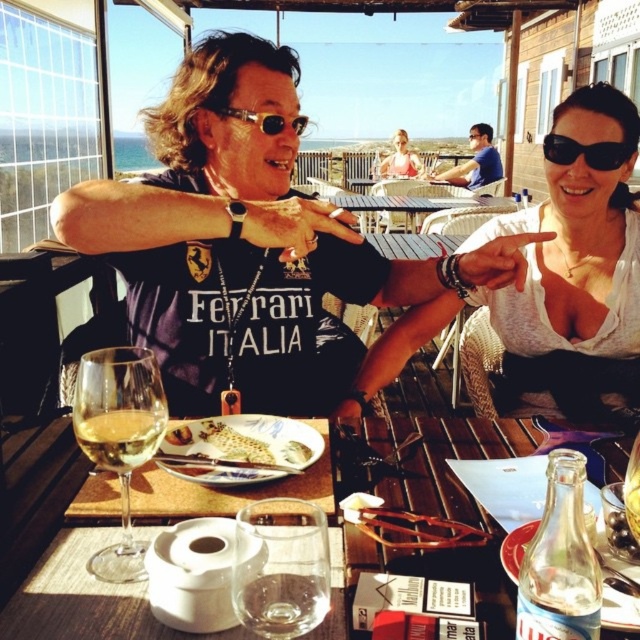
Question: Estimate the real-world distances between objects in this image. Which object is closer to the golden crispy bread at center?

Choices:
 (A) white creamy pasta at center
 (B) clear glass table at center

Answer: (A)

Question: Estimate the real-world distances between objects in this image. Which object is closer to the golden crispy pastry at center?

Choices:
 (A) translucent glass wine at lower left
 (B) white translucent glass at lower left
 (C) clear glass table at center
 (D) black plastic sunglasses at upper right

Answer: (A)

Question: Can you confirm if matte blue shirt at upper center is positioned to the left of pink fabric dress at center?

Choices:
 (A) no
 (B) yes

Answer: (A)

Question: Where is white glossy fish at center located in relation to golden crispy pastry at center in the image?

Choices:
 (A) right
 (B) left

Answer: (A)

Question: Estimate the real-world distances between objects in this image. Which object is closer to the golden crispy bread at center?

Choices:
 (A) golden crispy pastry at center
 (B) black plastic sunglasses at upper right
 (C) white translucent glass at lower left
 (D) white creamy pasta at center

Answer: (A)

Question: Considering the relative positions of clear glass table at center and golden crispy pastry at center in the image provided, where is clear glass table at center located with respect to golden crispy pastry at center?

Choices:
 (A) right
 (B) left

Answer: (A)